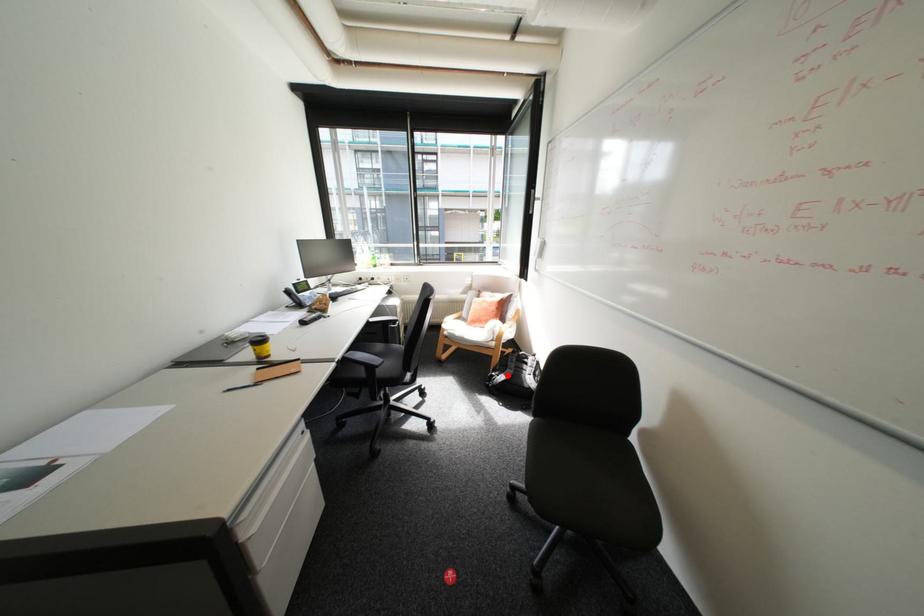
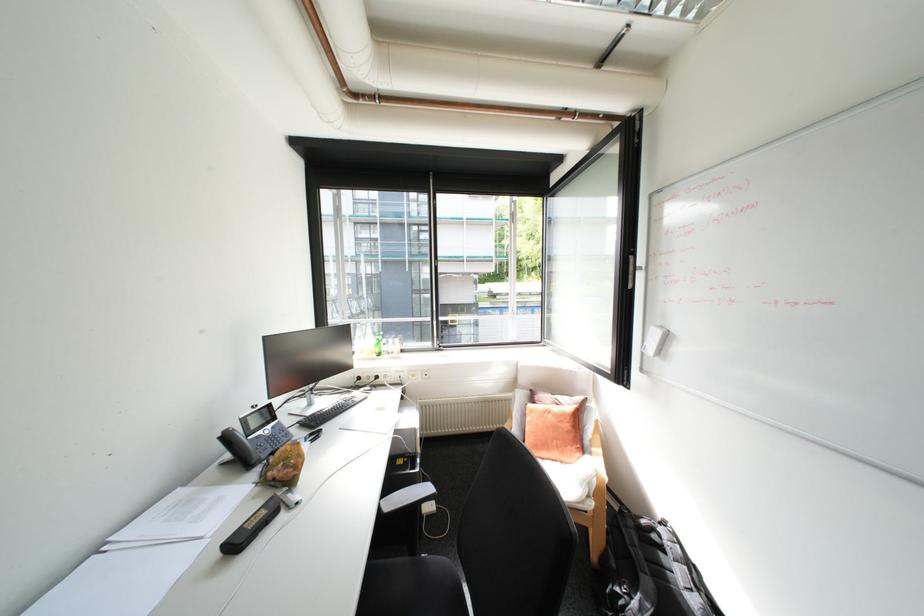
Find the pixel in the second image that matches the highlighted location in the first image.

(640, 598)